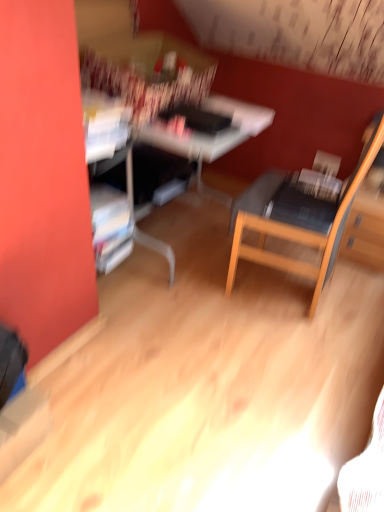
Question: From a real-world perspective, is wooden chair at center-right positioned above or below white glossy computer desk at center?

Choices:
 (A) below
 (B) above

Answer: (B)

Question: Is point (240, 203) closer or farther from the camera than point (256, 113)?

Choices:
 (A) closer
 (B) farther

Answer: (A)

Question: Considering their positions, is wooden chair at center-right located in front of or behind white glossy computer desk at center?

Choices:
 (A) behind
 (B) front

Answer: (B)

Question: In terms of size, does white glossy computer desk at center appear bigger or smaller than wooden chair at center-right?

Choices:
 (A) big
 (B) small

Answer: (A)

Question: In the image, is white glossy computer desk at center positioned in front of or behind wooden chair at center-right?

Choices:
 (A) behind
 (B) front

Answer: (A)

Question: From their relative heights in the image, would you say white glossy computer desk at center is taller or shorter than wooden chair at center-right?

Choices:
 (A) tall
 (B) short

Answer: (B)

Question: From the image's perspective, is white glossy computer desk at center above or below wooden chair at center-right?

Choices:
 (A) above
 (B) below

Answer: (A)